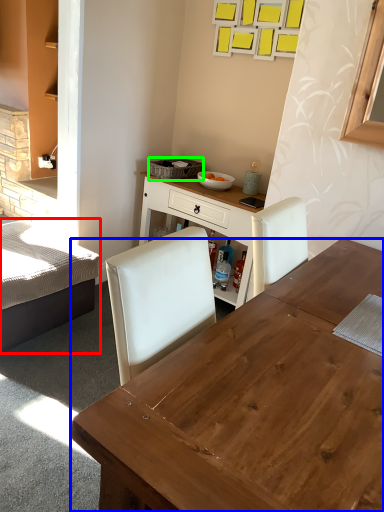
Question: Estimate the real-world distances between objects in this image. Which object is closer to bed (highlighted by a red box), desk (highlighted by a blue box) or picnic basket (highlighted by a green box)?

Choices:
 (A) desk
 (B) picnic basket

Answer: (B)